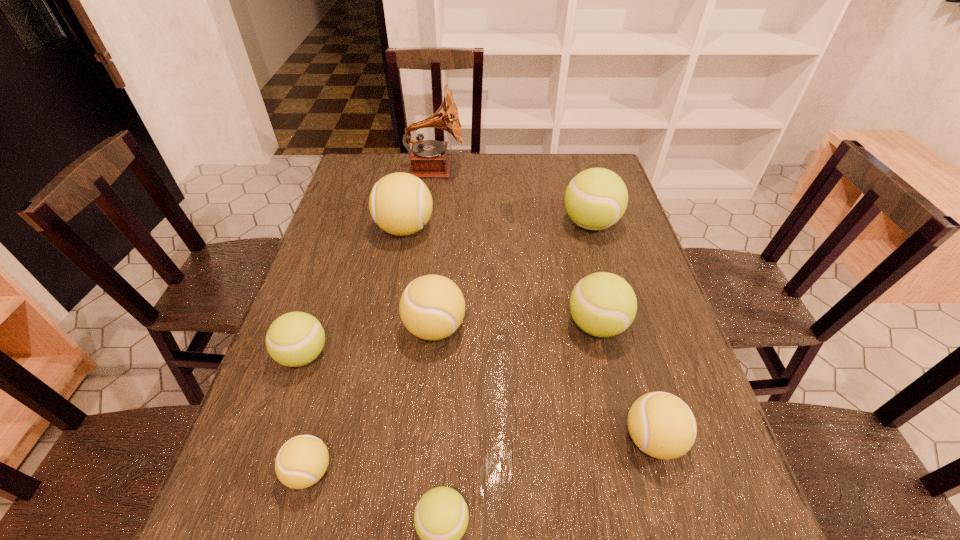
This screenshot has height=540, width=960. Find the location of `vacant space located 0.300m on the front of the farthest green tennis ball`. vacant space located 0.300m on the front of the farthest green tennis ball is located at coordinates (619, 324).

Image resolution: width=960 pixels, height=540 pixels. What are the coordinates of `vacant point located 0.280m on the front of the farthest yellow tennis ball` in the screenshot? It's located at (386, 326).

This screenshot has height=540, width=960. What are the coordinates of `free region located 0.160m on the front of the second biggest yellow tennis ball` in the screenshot? It's located at (426, 420).

At what (x,y) coordinates should I click in order to perform the action: click on free point located 0.370m on the back of the third smallest green tennis ball. Please return your answer as a coordinate pair (x, y). This screenshot has height=540, width=960. Looking at the image, I should click on (570, 214).

I want to click on vacant space located 0.070m on the right of the rightmost yellow tennis ball, so click(x=719, y=440).

Locate an element on the screen. The image size is (960, 540). vacant space located 0.390m on the back of the leftmost green tennis ball is located at coordinates (346, 230).

Identify the location of vacant region located 0.140m on the back of the smallest yellow tennis ball. The image size is (960, 540). (332, 384).

Image resolution: width=960 pixels, height=540 pixels. Find the location of `object that is at the far edge`. object that is at the far edge is located at coordinates (428, 158).

At what (x,y) coordinates should I click in order to perform the action: click on vacant space at the far edge of the desktop. Please return your answer as a coordinate pair (x, y). Image resolution: width=960 pixels, height=540 pixels. Looking at the image, I should click on (x=536, y=155).

This screenshot has width=960, height=540. In the image, there is a desktop. What are the coordinates of `free space at the left edge` in the screenshot? It's located at (334, 310).